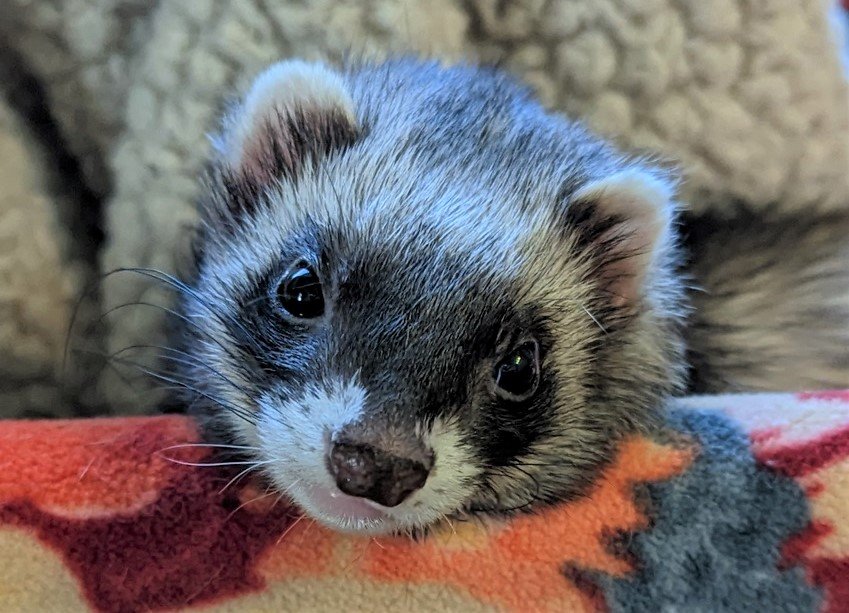
Locate an element on the screen. orange coloring on blanket is located at coordinates (529, 553).